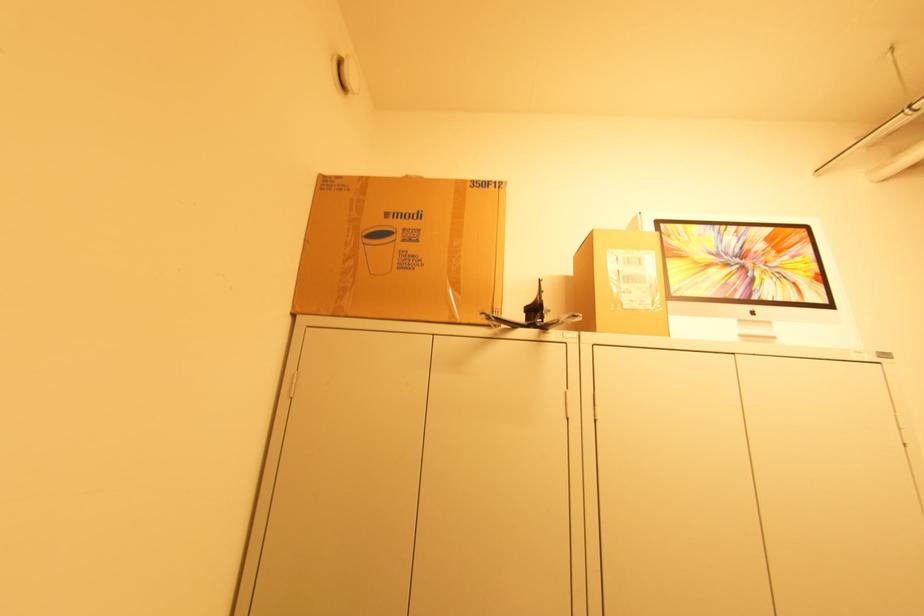
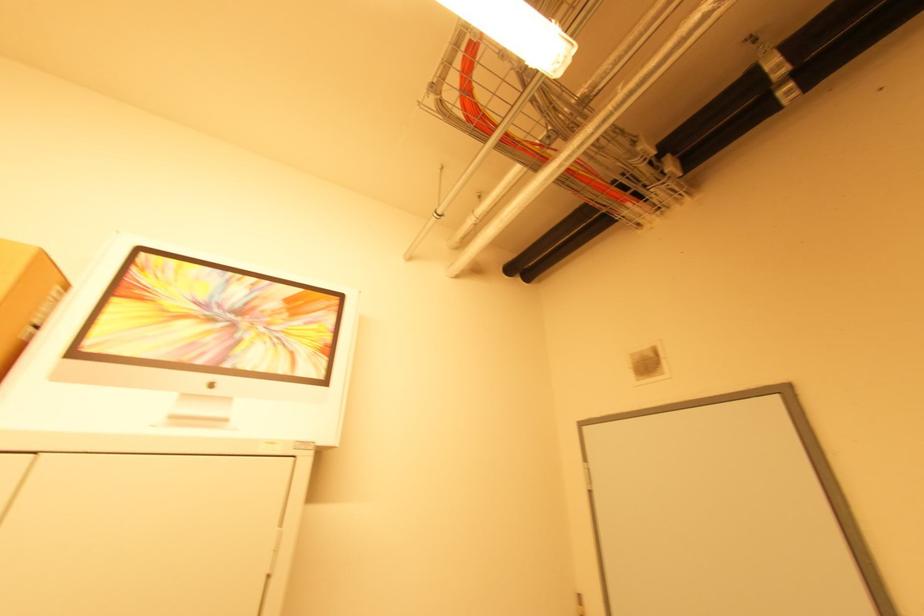
The point at (671, 261) is marked in the first image. Where is the corresponding point in the second image?

(117, 300)